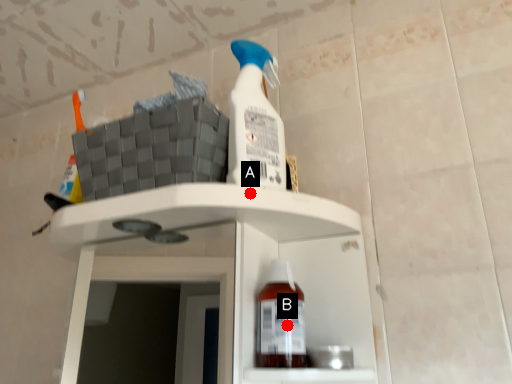
Question: Two points are circled on the image, labeled by A and B beside each circle. Which point is closer to the camera?

Choices:
 (A) A is closer
 (B) B is closer

Answer: (A)